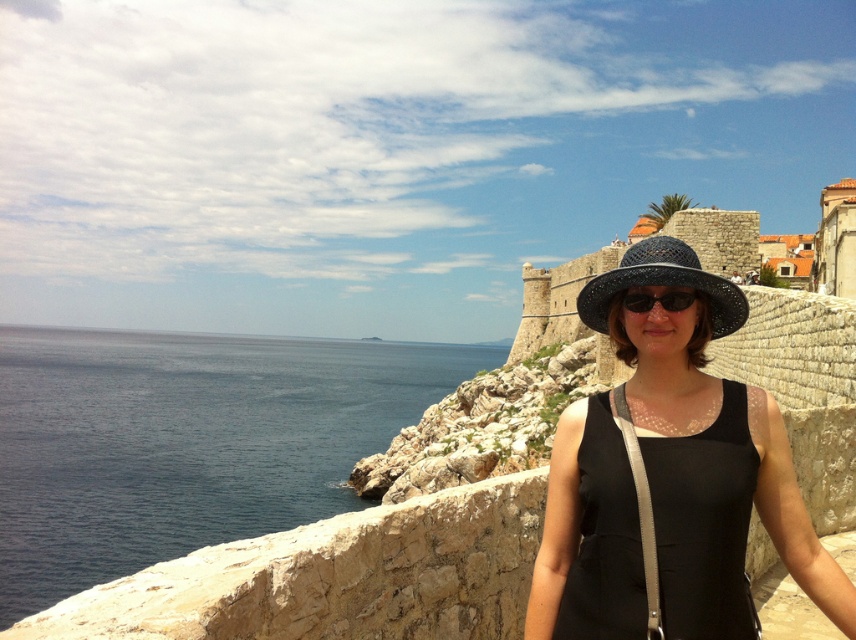
Which of these two, black woven hat at center or black matte sunglasses at center, stands taller?

Standing taller between the two is black woven hat at center.

Between point (851, 612) and point (676, 296), which one is positioned in front?

Point (851, 612) is more forward.

Is point (635, 408) farther from camera compared to point (690, 305)?

No, it is in front of (690, 305).

Find the location of `black woven hat at center`. black woven hat at center is located at coordinates (706, 449).

Is black woven hat at center positioned at the back of blue woven hat at center?

No, it is in front of blue woven hat at center.

Between point (652, 397) and point (583, 320), which one is positioned behind?

Point (583, 320)

Locate an element on the screen. The image size is (856, 640). black woven hat at center is located at coordinates (706, 449).

Is point (110, 525) closer to camera compared to point (596, 288)?

No.

This screenshot has height=640, width=856. Describe the element at coordinates (186, 442) in the screenshot. I see `dark blue water at left` at that location.

At what (x,y) coordinates should I click in order to perform the action: click on dark blue water at left. Please return your answer as a coordinate pair (x, y). Looking at the image, I should click on (186, 442).